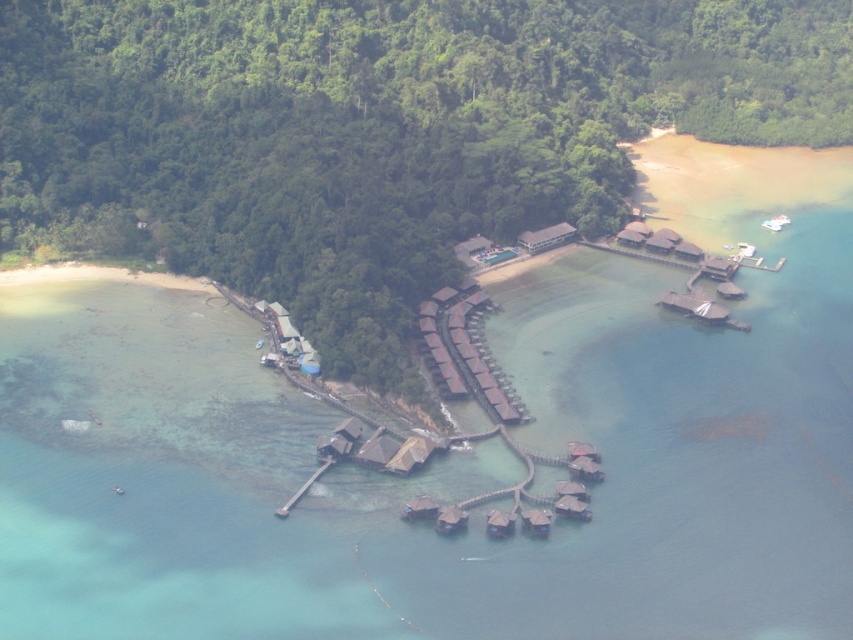
You are standing on the wooden dock at lower center and want to reach the brown wooden hut at center. Which direction should you move to get there?

The brown wooden hut at center is located above the wooden dock at lower center, so you should move upward to reach it.

You are planning to host a small gathering for 10 people. Given the brown wooden hut at center and the wooden dock at lower center, which location would be more suitable for accommodating everyone comfortably?

The brown wooden hut at center is bigger than the wooden dock at lower center, so it would be more suitable for accommodating 10 people comfortably.